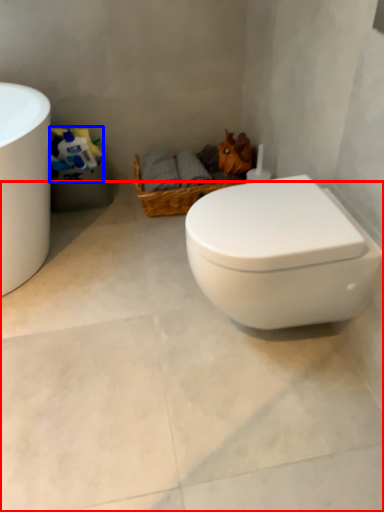
Question: Which of the following is the farthest to the observer, concrete (highlighted by a red box) or toilet paper (highlighted by a blue box)?

Choices:
 (A) concrete
 (B) toilet paper

Answer: (B)